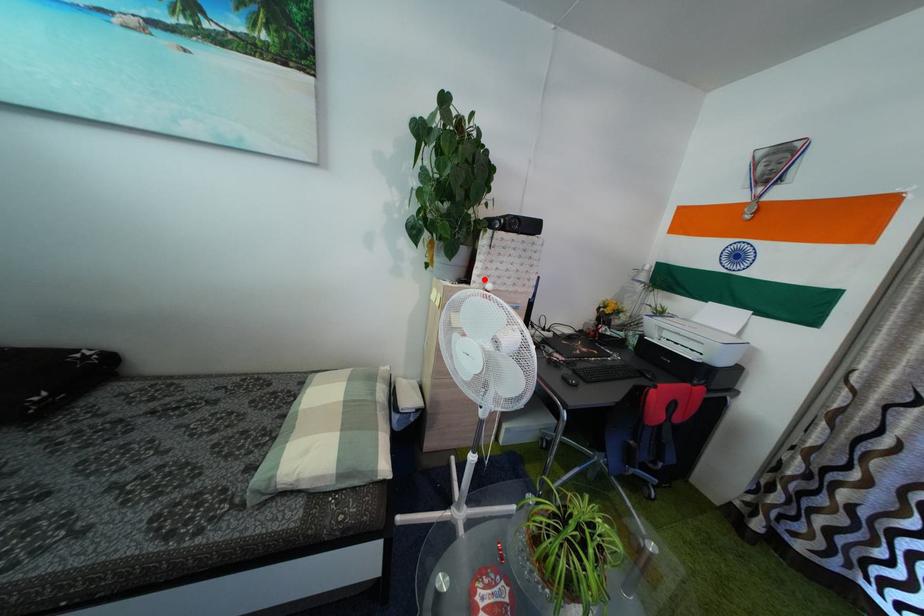
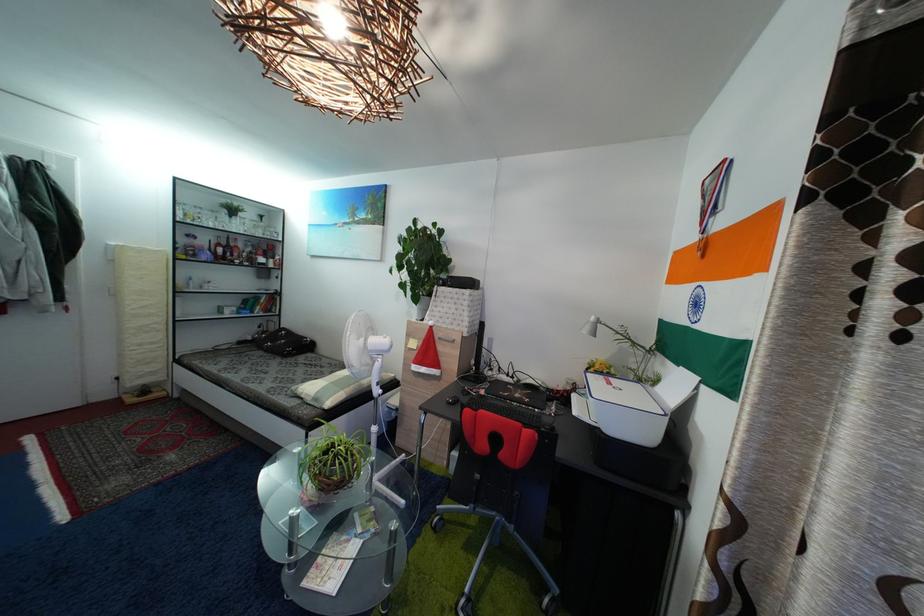
In the second image, find the point that corresponds to the highlighted location in the first image.

(435, 321)